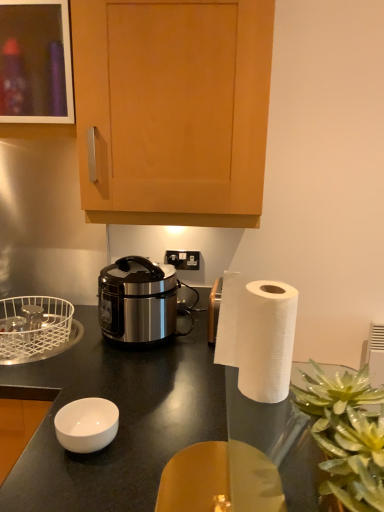
You are a GUI agent. You are given a task and a screenshot of the screen. Output one action in this format:
    pyautogui.click(x=<x>, y=<y>)
    Task: Click on the vacant space in front of stainless steel rice cooker at center
    Image resolution: width=384 pixels, height=512 pixels.
    Given the screenshot: What is the action you would take?
    pyautogui.click(x=146, y=368)